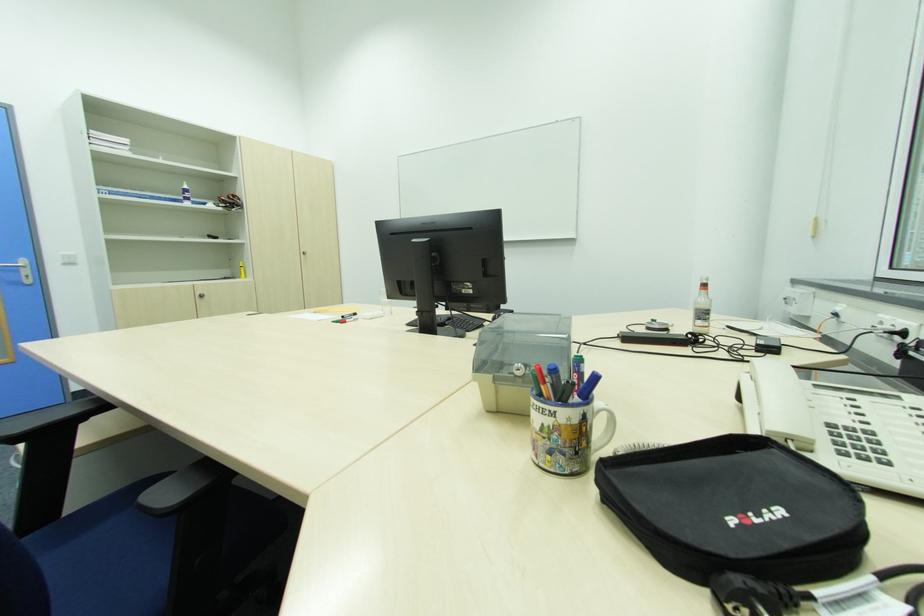
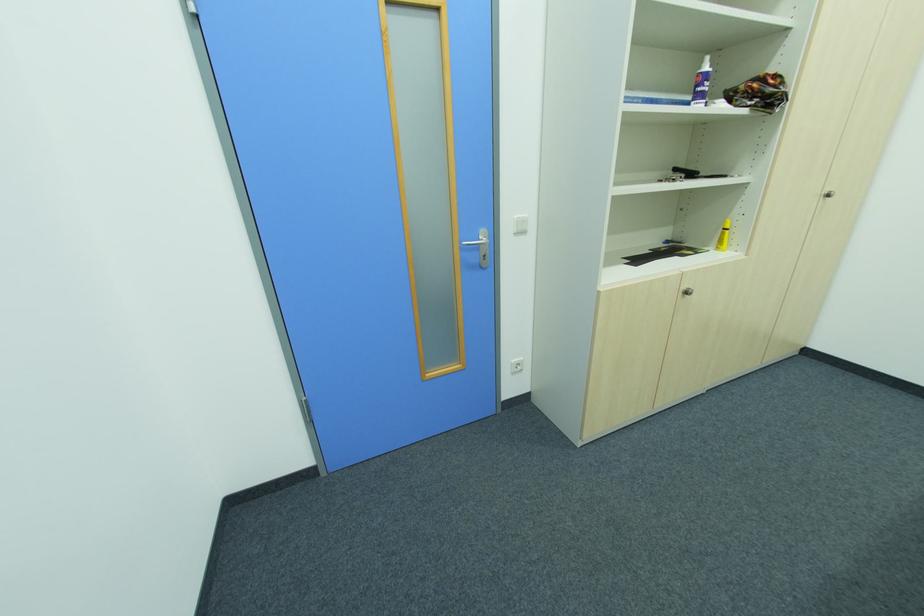
Where in the second image is the point corresponding to the point at 204,297 from the first image?

(689, 294)